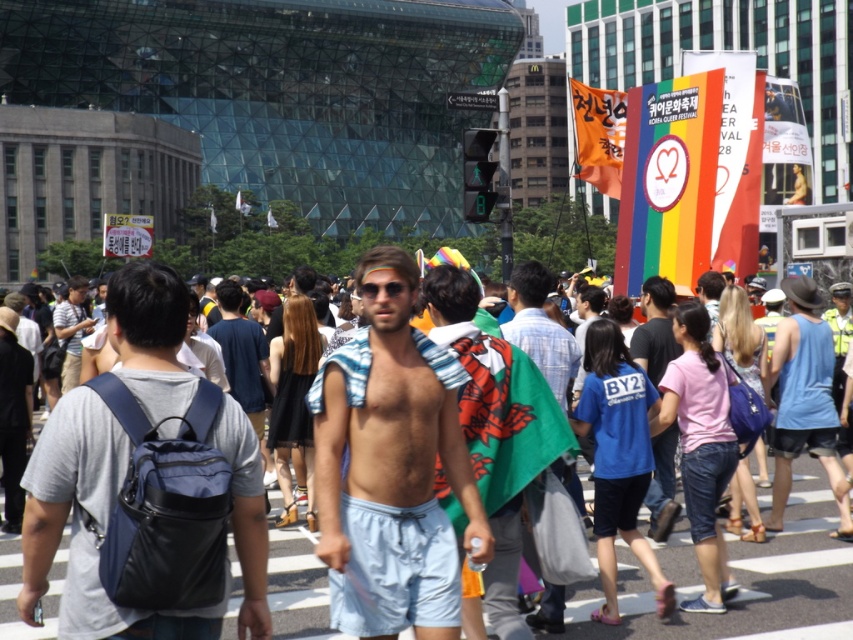
Does blue fabric tank top at center-right have a larger size compared to light brown hair at center?

Actually, blue fabric tank top at center-right might be smaller than light brown hair at center.

How far apart are blue fabric tank top at center-right and light brown hair at center?

A distance of 68.58 feet exists between blue fabric tank top at center-right and light brown hair at center.

Who is more forward, [805,369] or [259,362]?

Positioned in front is point [805,369].

Identify the location of blue fabric tank top at center-right. This screenshot has height=640, width=853. (801, 392).

Does light blue cotton shorts at center have a greater width compared to gray fabric backpack at center?

Incorrect, light blue cotton shorts at center's width does not surpass gray fabric backpack at center's.

The image size is (853, 640). Identify the location of light blue cotton shorts at center. pos(392,467).

Who is higher up, green fabric flag at center or light brown hair at center?

light brown hair at center is above.

This screenshot has width=853, height=640. Find the location of `green fabric flag at center`. green fabric flag at center is located at coordinates (496, 429).

Locate an element on the screen. The image size is (853, 640). green fabric flag at center is located at coordinates (496, 429).